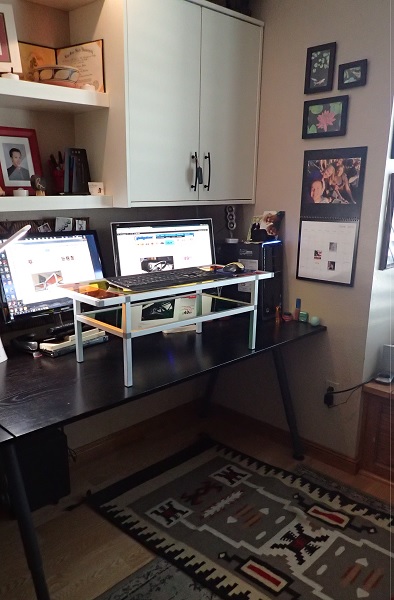
This screenshot has height=600, width=394. Find the location of `wooden table`. wooden table is located at coordinates (50, 407).